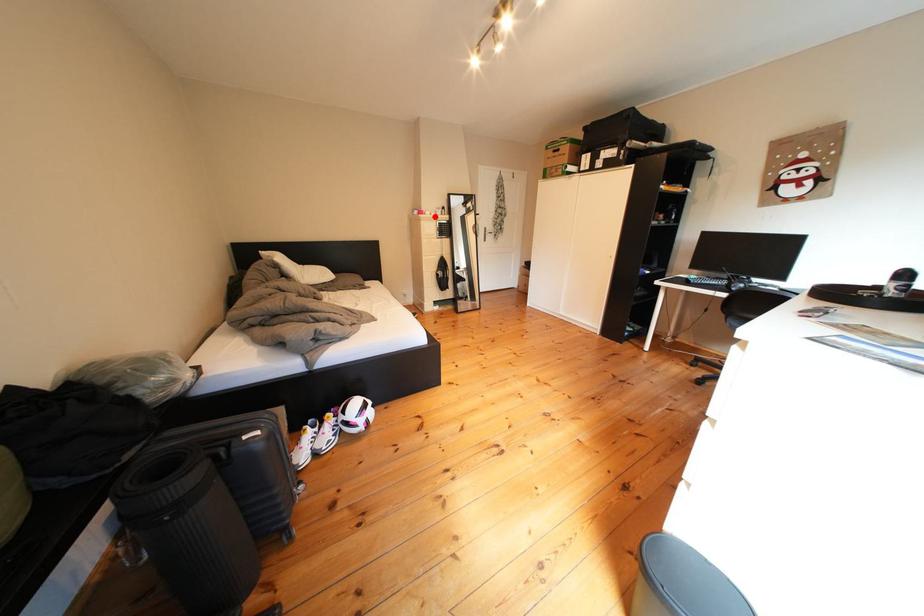
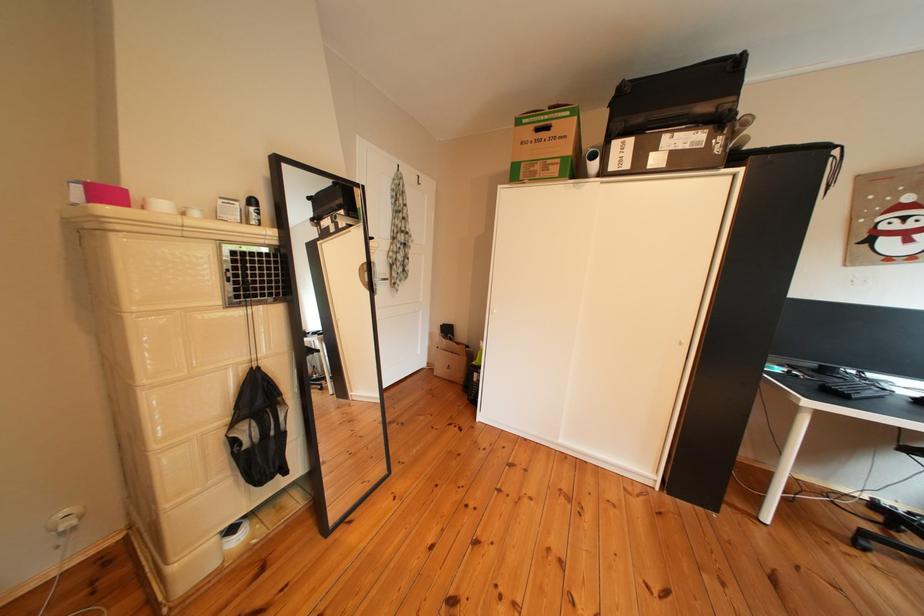
Find the pixel in the second image that matches the highlighted location in the first image.

(123, 199)